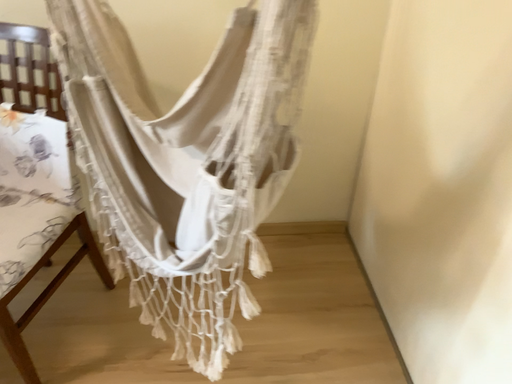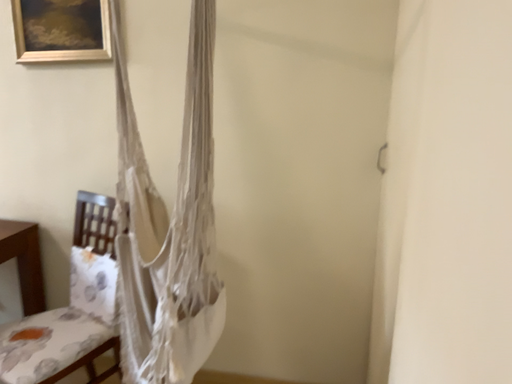
Question: Which way did the camera rotate in the video?

Choices:
 (A) rotated downward
 (B) rotated upward

Answer: (B)